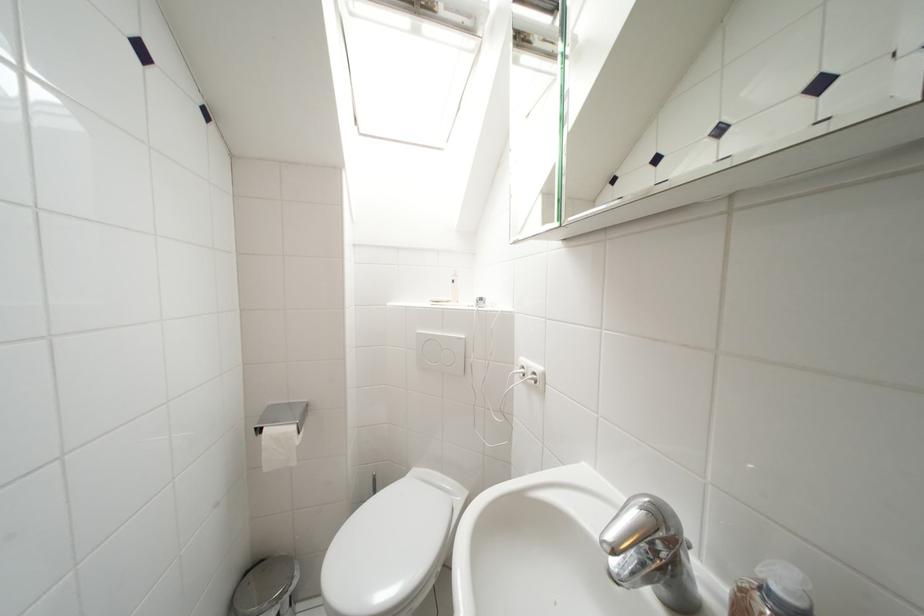
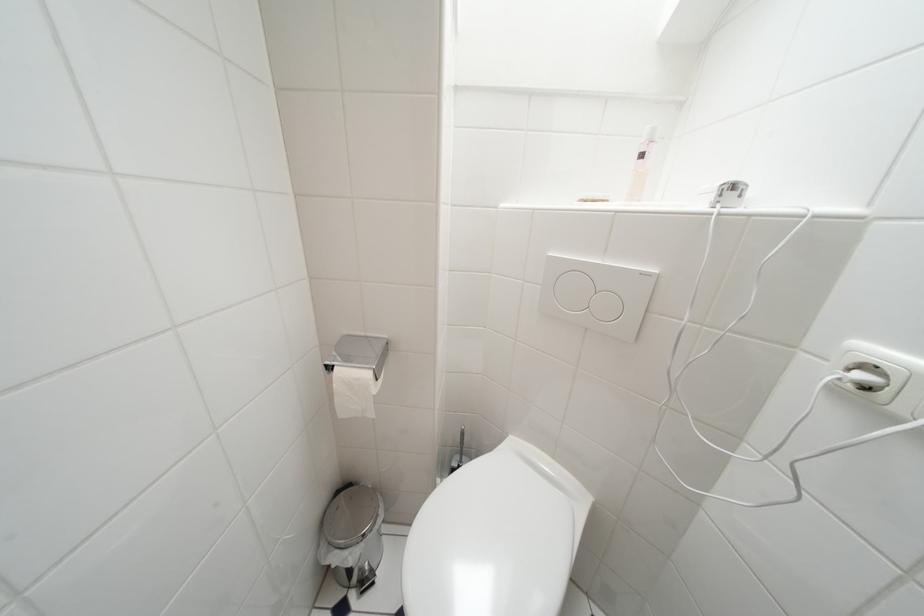
The images are taken continuously from a first-person perspective. In which direction are you moving?

The movement direction of the cameraman is left, forward.